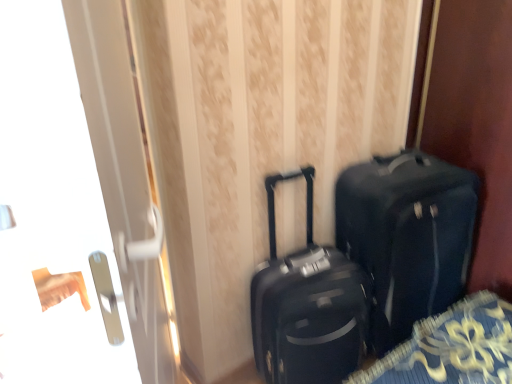
Question: Considering the positions of matte black suitcase at center and matte black suitcase at center in the image, is matte black suitcase at center taller or shorter than matte black suitcase at center?

Choices:
 (A) tall
 (B) short

Answer: (B)

Question: Is matte black suitcase at center spatially inside matte black suitcase at center, or outside of it?

Choices:
 (A) inside
 (B) outside

Answer: (B)

Question: Estimate the real-world distances between objects in this image. Which object is closer to the matte black suitcase at center?

Choices:
 (A) matte black suitcase at center
 (B) transparent glass door at left

Answer: (A)

Question: Which is farther from the transparent glass door at left?

Choices:
 (A) matte black suitcase at center
 (B) matte black suitcase at center

Answer: (B)